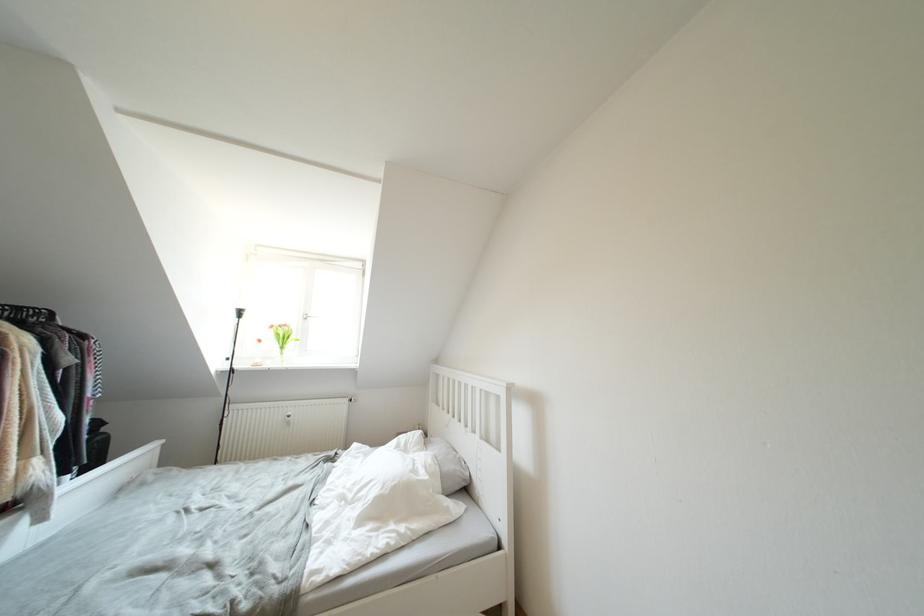
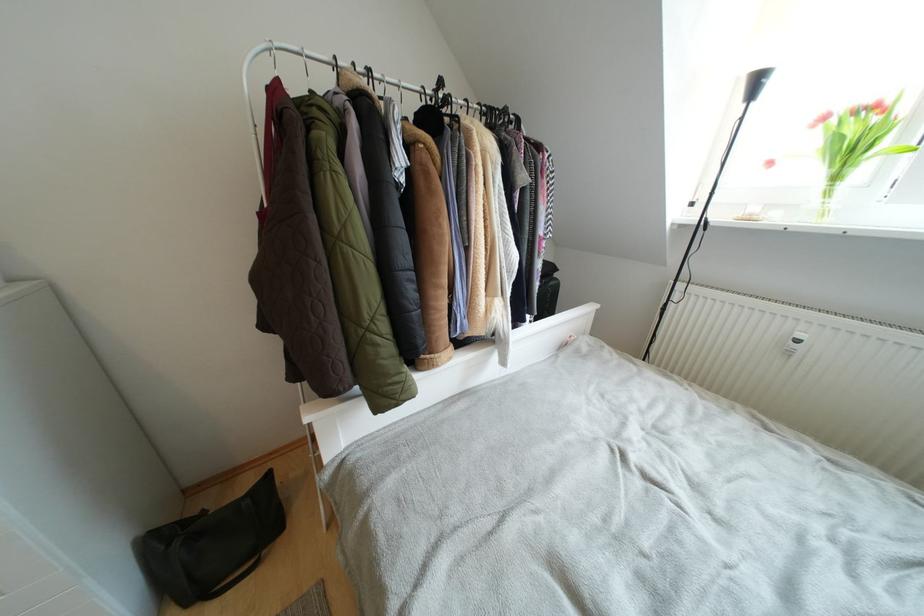
Where in the second image is the point corresponding to the point at 286,352 from the first image?

(840, 182)